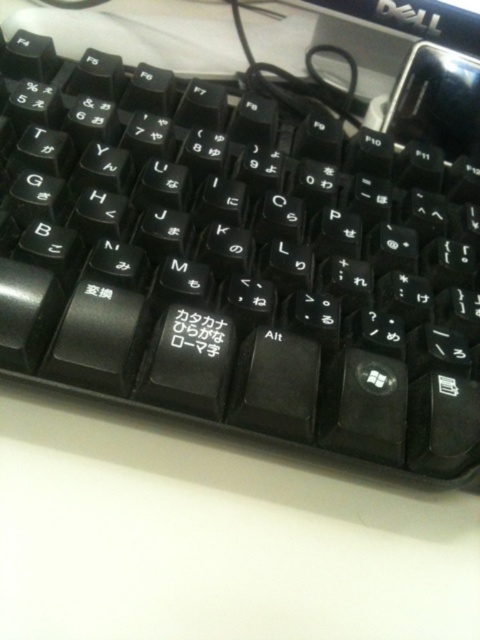
You are a photographer adjusting your camera settings. You notice two points in your viewfinder at coordinates point (101,253) and point (393,10). Based on the scene of the keyboard, which point is closer to the camera?

Point (101,253) is in front of point (393,10), so the point closer to the camera is point (101,253).

You are trying to locate two points on the Dell keyboard shown in the image. The first point is at coordinate point (330, 371) and the second is at point (183, 342). From your perspective, which point appears closer to you?

Point (330, 371) is further to the viewer than point (183, 342), so the point at (330, 371) appears closer to you.